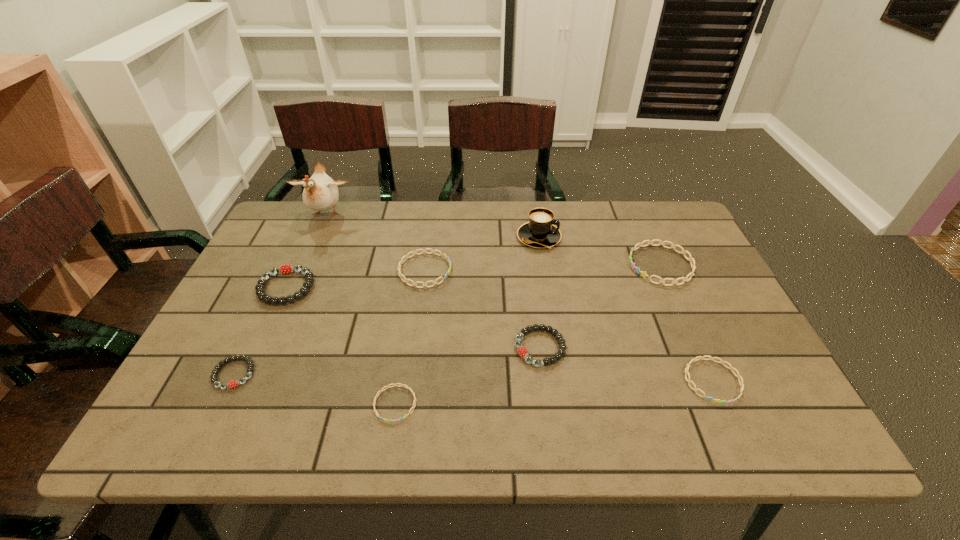
The width and height of the screenshot is (960, 540). I want to click on bird, so click(320, 193).

Identify the location of white bird. point(320,193).

Where is `black cappuccino`? black cappuccino is located at coordinates (540, 232).

Find the location of a particular element. Image resolution: width=960 pixels, height=540 pixels. the eighth shortest object is located at coordinates (540, 232).

The width and height of the screenshot is (960, 540). Identify the location of the biggest blue bracelet. (643, 274).

This screenshot has height=540, width=960. What are the coordinates of `the farthest black bracelet` in the screenshot? It's located at (288, 269).

Locate an element on the screen. The height and width of the screenshot is (540, 960). the third smallest blue bracelet is located at coordinates (x=401, y=262).

I want to click on the second biggest black bracelet, so point(522,351).

You are a GUI agent. You are given a task and a screenshot of the screen. Output one action in this format:
    pyautogui.click(x=<x>, y=<y>)
    Task: Click on the fifth bracelet from left to right
    
    Given the screenshot: What is the action you would take?
    pyautogui.click(x=522, y=351)

You are a GUI agent. You are given a task and a screenshot of the screen. Output one action in this format:
    pyautogui.click(x=<x>, y=<y>)
    Task: Click on the second smallest blue bracelet
    
    Given the screenshot: What is the action you would take?
    pyautogui.click(x=731, y=368)